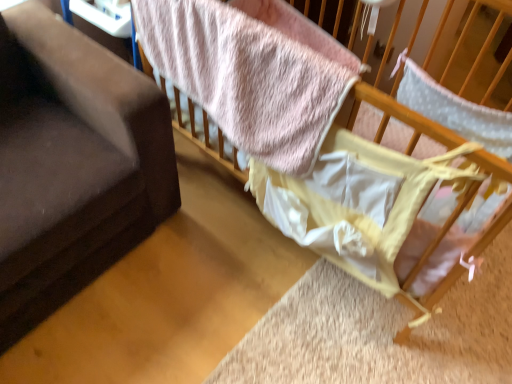
Question: Choose the correct answer: Is soft pink fabric at upper right inside dark gray fabric couch at left or outside it?

Choices:
 (A) outside
 (B) inside

Answer: (A)

Question: In terms of width, does soft pink fabric at upper right look wider or thinner when compared to dark gray fabric couch at left?

Choices:
 (A) thin
 (B) wide

Answer: (B)

Question: Which object is positioned farthest from the dark gray fabric couch at left?

Choices:
 (A) soft pink fabric at upper right
 (B) pink fuzzy blanket at upper center

Answer: (A)

Question: Estimate the real-world distances between objects in this image. Which object is closer to the soft pink fabric at upper right?

Choices:
 (A) dark gray fabric couch at left
 (B) pink fuzzy blanket at upper center

Answer: (B)